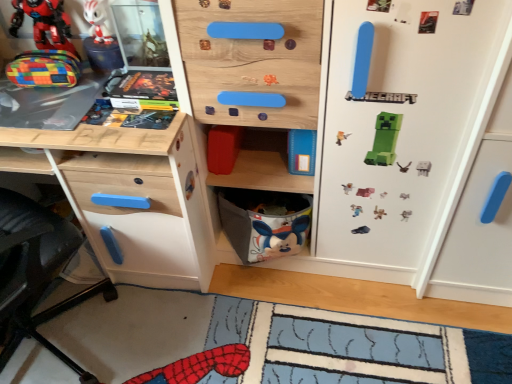
The image size is (512, 384). I want to click on free space that is in between white matte fridge at center and wooden desk at left, so click(289, 296).